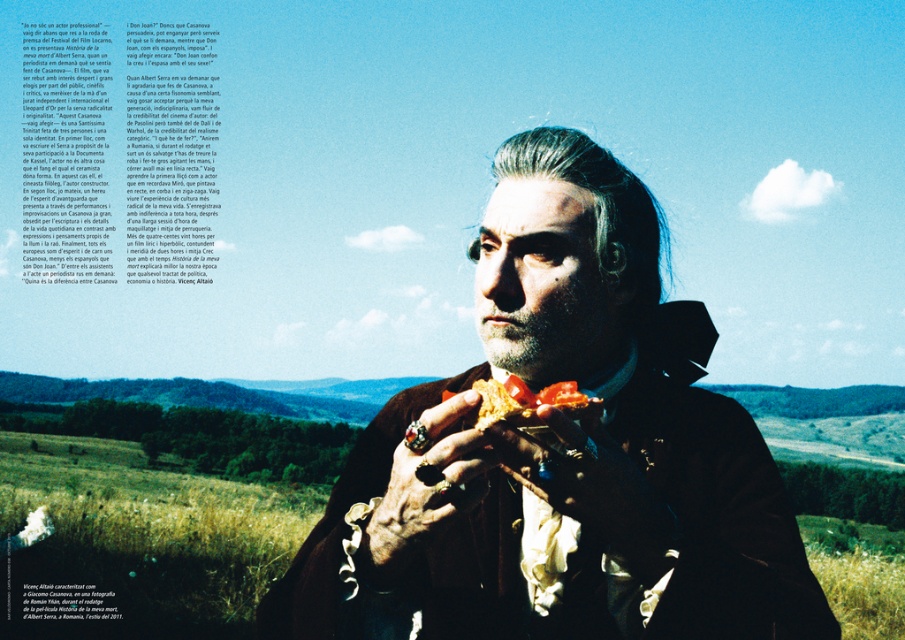
Question: Which point is farther from the camera taking this photo?

Choices:
 (A) coord(550,483)
 (B) coord(559,381)
 (C) coord(437,452)
 (D) coord(717,401)

Answer: (D)

Question: Which object is closer to the camera taking this photo?

Choices:
 (A) velvet brown coat at center
 (B) rustic leather glove at center
 (C) golden crumbly bread at center
 (D) rusty metal hand at center

Answer: (A)

Question: Is rusty metal hand at center positioned behind golden crumbly bread at center?

Choices:
 (A) no
 (B) yes

Answer: (A)

Question: In this image, where is rustic leather glove at center located relative to golden crumbly bread at center?

Choices:
 (A) above
 (B) below

Answer: (B)

Question: Which is farther from the rusty metal hand at center?

Choices:
 (A) rustic leather glove at center
 (B) velvet brown coat at center

Answer: (B)

Question: Does rustic leather glove at center have a larger size compared to rusty metal hand at center?

Choices:
 (A) yes
 (B) no

Answer: (B)